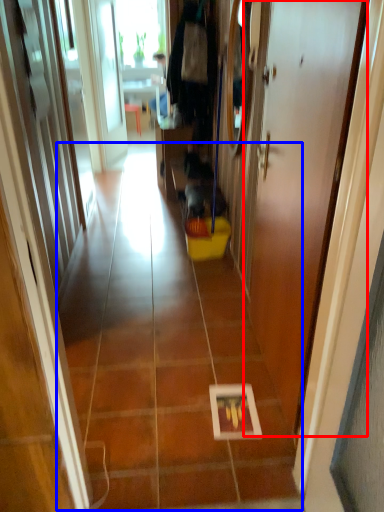
Question: Which point is closer to the camera, door (highlighted by a red box) or path (highlighted by a blue box)?

Choices:
 (A) door
 (B) path

Answer: (A)